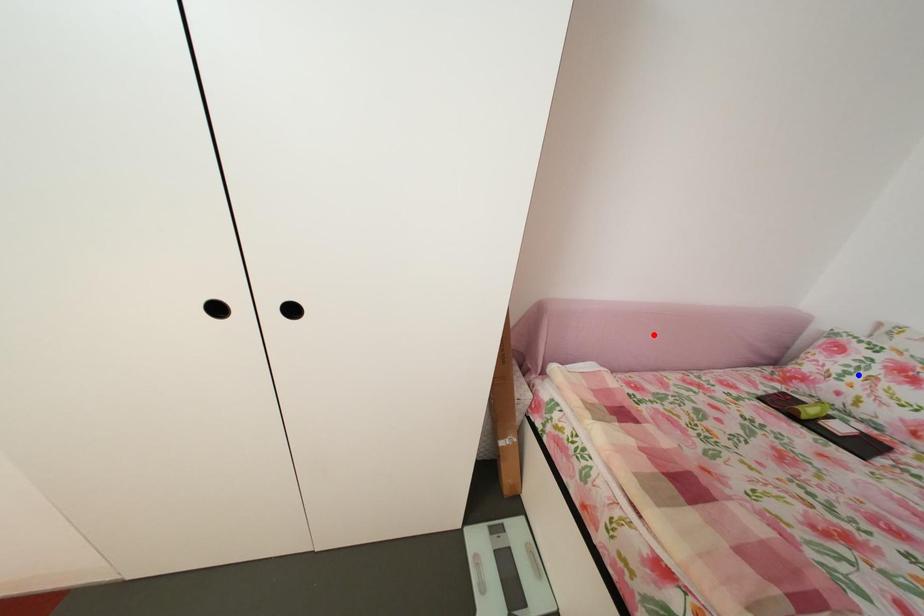
Question: Two points are marked on the image. Which point is closer to the camera?

Choices:
 (A) Blue point is closer.
 (B) Red point is closer.

Answer: (A)